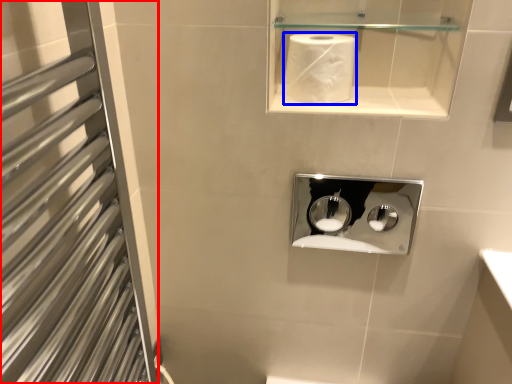
Question: Among these objects, which one is farthest to the camera, screen door (highlighted by a red box) or paper towel (highlighted by a blue box)?

Choices:
 (A) screen door
 (B) paper towel

Answer: (B)